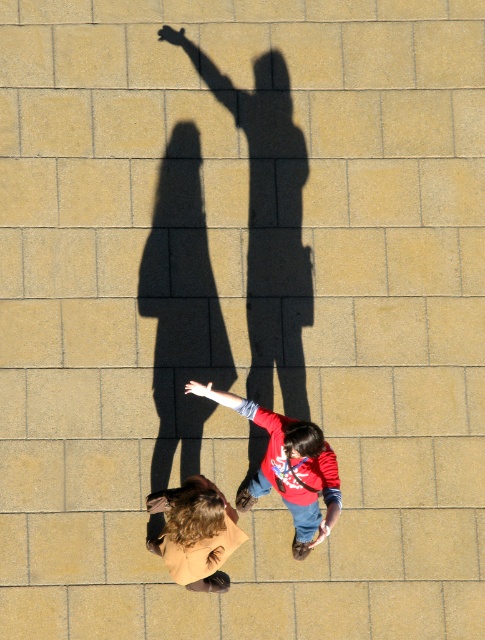
Question: Which of the following is the closest to the observer?

Choices:
 (A) (252, 419)
 (B) (257, 408)
 (C) (222, 88)
 (D) (168, 26)

Answer: (A)

Question: Does smooth black hand at upper center have a smaller size compared to light skin tone flesh at lower center?

Choices:
 (A) yes
 (B) no

Answer: (A)

Question: Which object is positioned farthest from the smooth skin hand at center?

Choices:
 (A) brown leather jacket at lower left
 (B) matte red arm at center
 (C) light skin tone flesh at lower center

Answer: (C)

Question: Can you confirm if brown leather jacket at lower left is positioned above smooth black hand at upper center?

Choices:
 (A) no
 (B) yes

Answer: (A)

Question: Which point appears closest to the camera in this image?

Choices:
 (A) (298, 461)
 (B) (235, 406)
 (C) (180, 44)

Answer: (A)

Question: Is red cotton shirt at lower center positioned before light skin tone flesh at lower center?

Choices:
 (A) no
 (B) yes

Answer: (B)